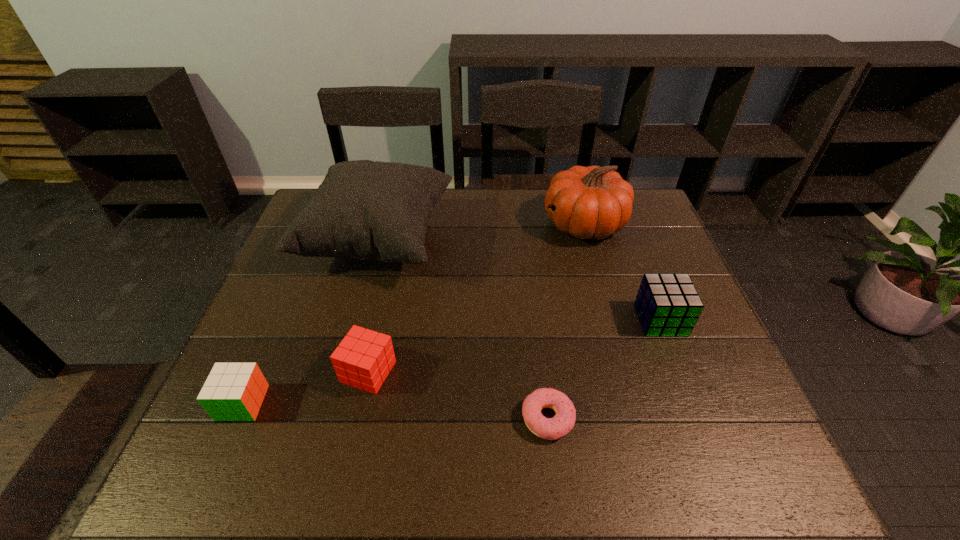
In the image, there is a desktop. Where is `vacant area at the far right corner`? vacant area at the far right corner is located at coordinates (641, 221).

The image size is (960, 540). What are the coordinates of `vacant area that lies between the second cube from right to left and the shortest object` in the screenshot? It's located at (458, 395).

Find the location of a particular element. vacant space in between the farthest cube and the second cube from left to right is located at coordinates click(515, 346).

Identify the location of free space between the leftmost cube and the pumpkin. The height and width of the screenshot is (540, 960). (414, 314).

Image resolution: width=960 pixels, height=540 pixels. What are the coordinates of `free space between the pumpkin and the cushion` in the screenshot? It's located at (481, 232).

Locate an element on the screen. This screenshot has height=540, width=960. free space between the cushion and the pumpkin is located at coordinates (481, 232).

Image resolution: width=960 pixels, height=540 pixels. Find the location of `vacant area that lies between the farthest cube and the second cube from right to left`. vacant area that lies between the farthest cube and the second cube from right to left is located at coordinates (515, 346).

This screenshot has width=960, height=540. In order to click on free space between the second cube from left to right and the cushion in this screenshot , I will do `click(373, 306)`.

You are a GUI agent. You are given a task and a screenshot of the screen. Output one action in this format:
    pyautogui.click(x=<x>, y=<y>)
    Task: Click on the vacant area that lies between the shortest object and the pumpkin
    Image resolution: width=960 pixels, height=540 pixels.
    Given the screenshot: What is the action you would take?
    pyautogui.click(x=565, y=321)

At what (x,y) coordinates should I click in order to perform the action: click on vacant region between the third object from right to left and the second cube from left to right. Please return your answer as a coordinate pair (x, y). This screenshot has width=960, height=540. Looking at the image, I should click on (458, 395).